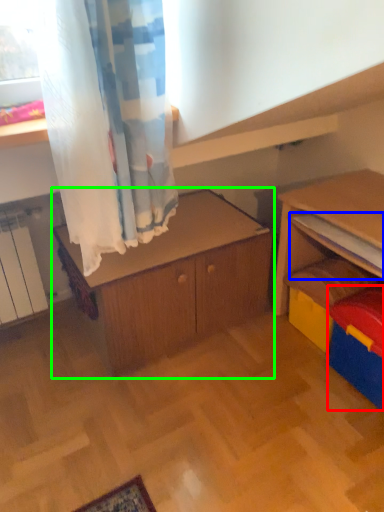
Question: Which is farther away from storage box (highlighted by a red box)? shelf (highlighted by a blue box) or cabinetry (highlighted by a green box)?

Choices:
 (A) shelf
 (B) cabinetry

Answer: (B)